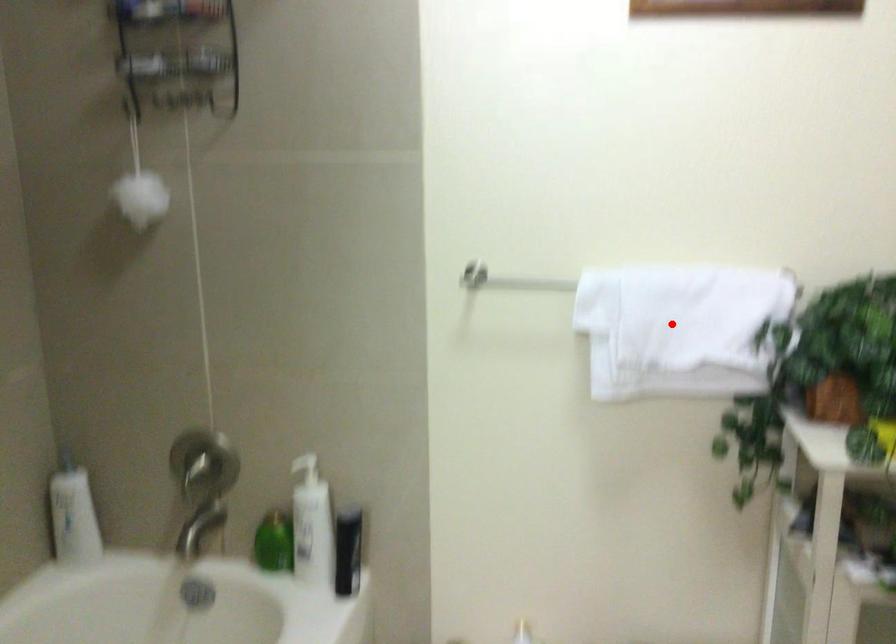
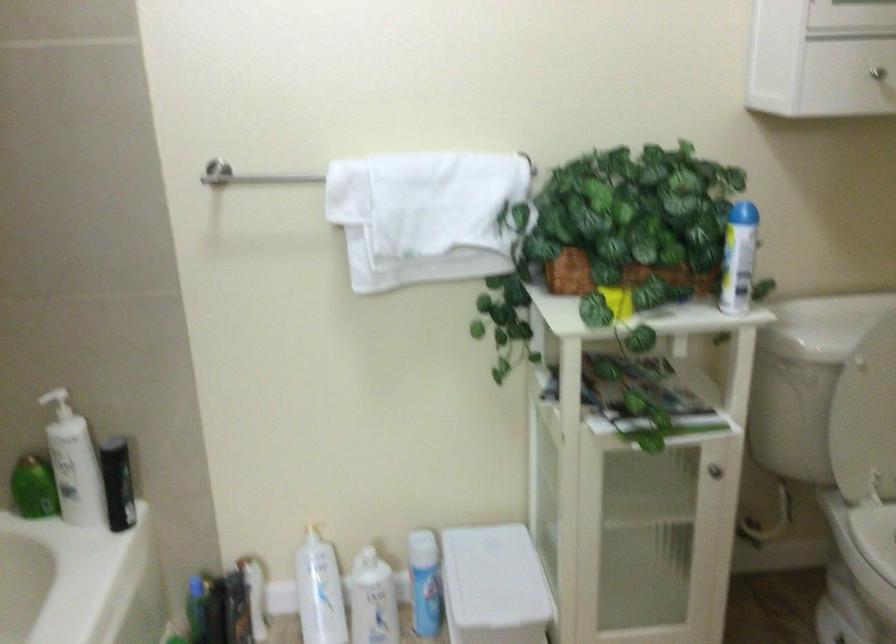
The point at the highlighted location is marked in the first image. Where is the corresponding point in the second image?

(424, 214)